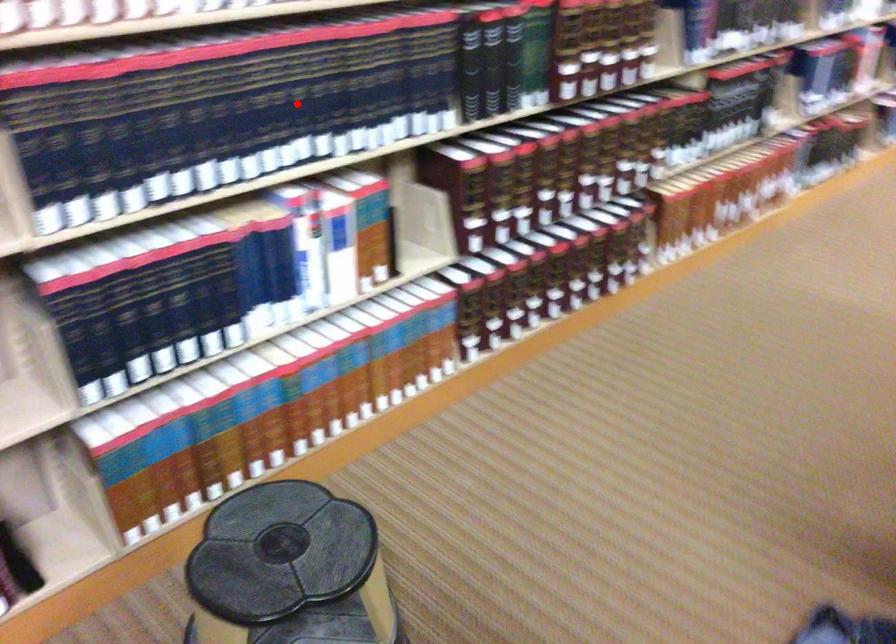
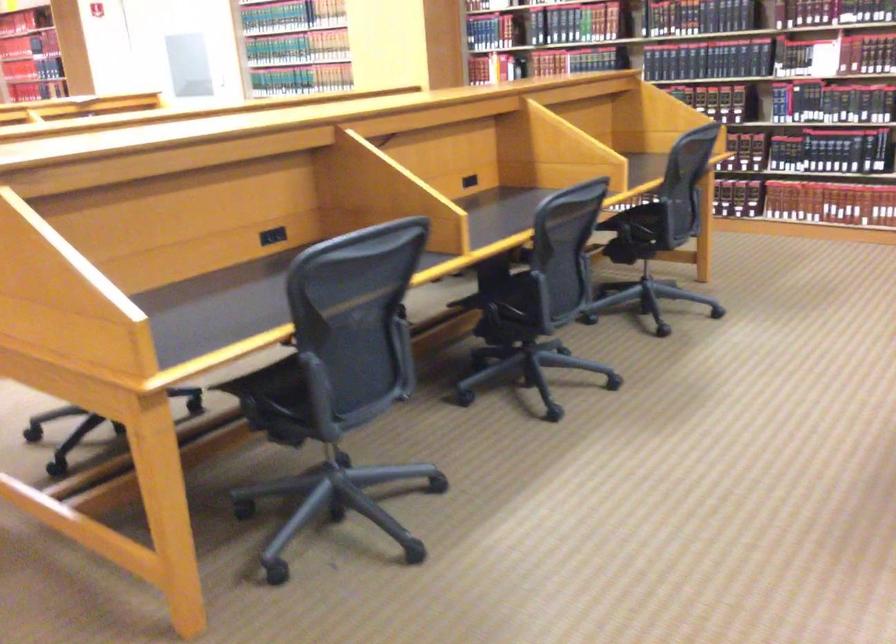
Question: I am providing you with two images of the same scene from different viewpoints. A red point is marked on the first image. Is the red point's position out of view in image 2?

Choices:
 (A) Yes
 (B) No

Answer: (A)